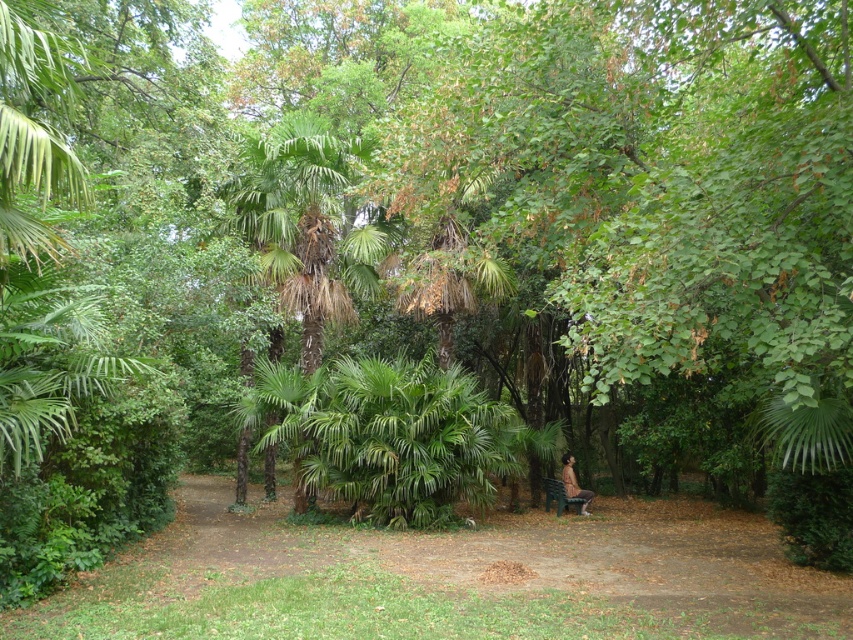
Question: Which of the following is the closest to the observer?

Choices:
 (A) green plastic bench at center
 (B) green leafy palm tree at center

Answer: (B)

Question: Which object is the closest to the green plastic bench at center?

Choices:
 (A) brown textured jacket at center
 (B) green leafy palm tree at center

Answer: (A)

Question: Which object is the farthest from the green plastic bench at center?

Choices:
 (A) green leafy palm tree at center
 (B) brown textured jacket at center

Answer: (A)

Question: From the image, what is the correct spatial relationship of brown textured jacket at center in relation to green plastic bench at center?

Choices:
 (A) right
 (B) left

Answer: (A)

Question: Does green leafy palm tree at center have a smaller size compared to green plastic bench at center?

Choices:
 (A) no
 (B) yes

Answer: (A)

Question: Can you confirm if green leafy palm tree at center is smaller than green plastic bench at center?

Choices:
 (A) yes
 (B) no

Answer: (B)